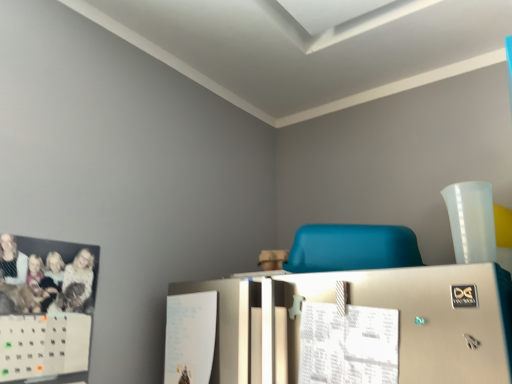
What do you see at coordinates (348, 344) in the screenshot? This screenshot has height=384, width=512. I see `white paper at center` at bounding box center [348, 344].

Locate an element on the screen. Image resolution: width=512 pixels, height=384 pixels. white paper at center is located at coordinates (348, 344).

This screenshot has height=384, width=512. Find the location of `blue matte chair at center`. blue matte chair at center is located at coordinates (352, 248).

This screenshot has width=512, height=384. Describe the element at coordinates (352, 248) in the screenshot. I see `blue matte chair at center` at that location.

This screenshot has width=512, height=384. Find the location of `white paper at center`. white paper at center is located at coordinates (348, 344).

Can you confirm if blue matte chair at center is positioned to the right of white paper at center?

Indeed, blue matte chair at center is positioned on the right side of white paper at center.

Between blue matte chair at center and white paper at center, which one is positioned in front?

white paper at center.

Considering the positions of point (326, 267) and point (384, 329), is point (326, 267) closer or farther from the camera than point (384, 329)?

Point (326, 267) is positioned farther from the camera compared to point (384, 329).

From the image's perspective, would you say blue matte chair at center is positioned over white paper at center?

Indeed, from the image's perspective, blue matte chair at center is shown above white paper at center.

From a real-world perspective, relative to white paper at center, is blue matte chair at center vertically above or below?

In terms of real-world spatial position, blue matte chair at center is above white paper at center.

Which of these two, blue matte chair at center or white paper at center, is thinner?

Thinner between the two is white paper at center.

Is blue matte chair at center shorter than white paper at center?

Yes, blue matte chair at center is shorter than white paper at center.

Between blue matte chair at center and white paper at center, which one has smaller size?

white paper at center is smaller.

Is white paper at center inside blue matte chair at center?

No, white paper at center is located outside of blue matte chair at center.

Are blue matte chair at center and white paper at center making contact?

They are not placed beside each other.

Is blue matte chair at center positioned with its back to white paper at center?

That's not correct — blue matte chair at center is not looking away from white paper at center.

Consider the image. How many degrees apart are the facing directions of blue matte chair at center and white paper at center?

They differ by 5.77 degrees in their facing directions.

How distant is blue matte chair at center from white paper at center?

blue matte chair at center and white paper at center are 8.00 inches apart.

Where is `paper lying in front of the blue matte chair at center`? The height and width of the screenshot is (384, 512). paper lying in front of the blue matte chair at center is located at coordinates (348, 344).

Can you confirm if white paper at center is positioned to the left of blue matte chair at center?

Yes, white paper at center is to the left of blue matte chair at center.

Looking at this image, is the position of white paper at center less distant than that of blue matte chair at center?

Yes.

Is point (325, 374) positioned after point (342, 241)?

No, it is not.

From the image's perspective, which one is positioned lower, white paper at center or blue matte chair at center?

From the image's view, white paper at center is below.

From a real-world perspective, which object rests below the other?

white paper at center is physically lower.

Can you confirm if white paper at center is thinner than blue matte chair at center?

Correct, the width of white paper at center is less than that of blue matte chair at center.

Consider the image. Which of these two, white paper at center or blue matte chair at center, stands shorter?

blue matte chair at center.

Considering the sizes of objects white paper at center and blue matte chair at center in the image provided, who is bigger, white paper at center or blue matte chair at center?

Bigger between the two is blue matte chair at center.

Choose the correct answer: Is white paper at center inside blue matte chair at center or outside it?

white paper at center cannot be found inside blue matte chair at center.

From the picture: Is white paper at center not near blue matte chair at center?

They are positioned close to each other.

Does white paper at center turn towards blue matte chair at center?

No, white paper at center is not facing towards blue matte chair at center.

Locate an element on the screen. This screenshot has width=512, height=384. furniture located on the right of white paper at center is located at coordinates (352, 248).

Where is `paper in front of the blue matte chair at center`? paper in front of the blue matte chair at center is located at coordinates pos(348,344).

In the image, there is a blue matte chair at center. Where is `paper below it (from a real-world perspective)`? paper below it (from a real-world perspective) is located at coordinates (348, 344).